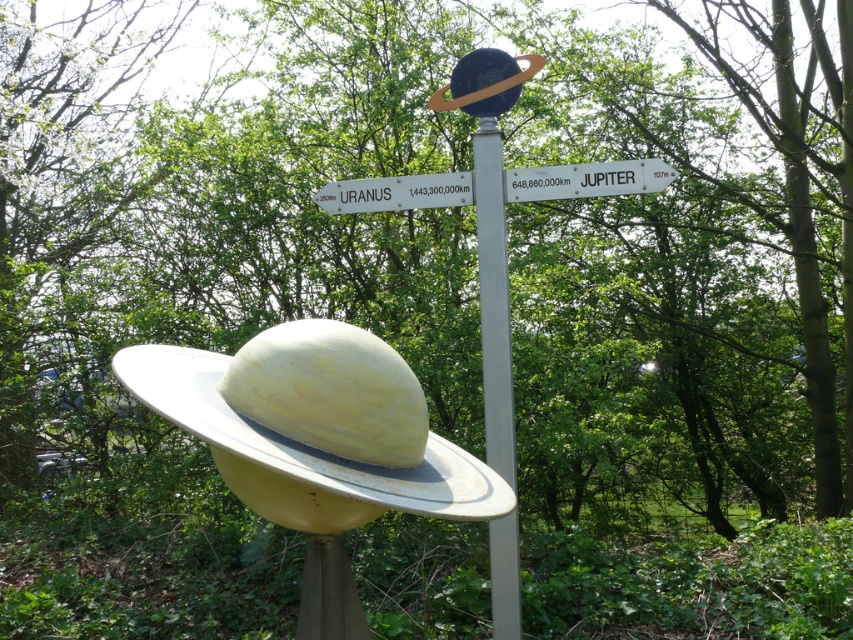
Can you confirm if white plastic pole at center is bigger than white plastic sign at upper right?

Yes.

Is point (480, 216) positioned after point (560, 170)?

That is False.

This screenshot has height=640, width=853. Identify the location of white plastic pole at center. (492, 298).

Who is higher up, white plastic sign at upper right or white plastic sign at upper center?

white plastic sign at upper right is higher up.

Which is in front, point (616, 166) or point (387, 205)?

Point (616, 166) is in front.

Where is `white plastic sign at upper right`? The height and width of the screenshot is (640, 853). white plastic sign at upper right is located at coordinates (587, 179).

Between matte yellow hat at center and white plastic sign at upper center, which one is positioned higher?

white plastic sign at upper center is above.

Does matte yellow hat at center appear under white plastic sign at upper center?

Yes.

You are a GUI agent. You are given a task and a screenshot of the screen. Output one action in this format:
    pyautogui.click(x=<x>, y=<y>)
    Task: Click on the matte yellow hat at center
    
    Given the screenshot: What is the action you would take?
    pyautogui.click(x=316, y=444)

I want to click on matte yellow hat at center, so click(x=316, y=444).